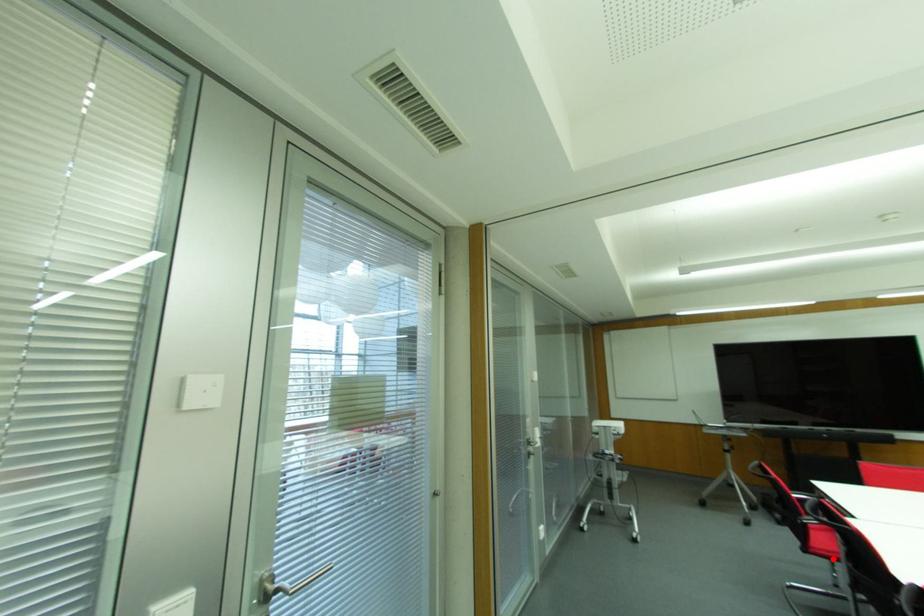
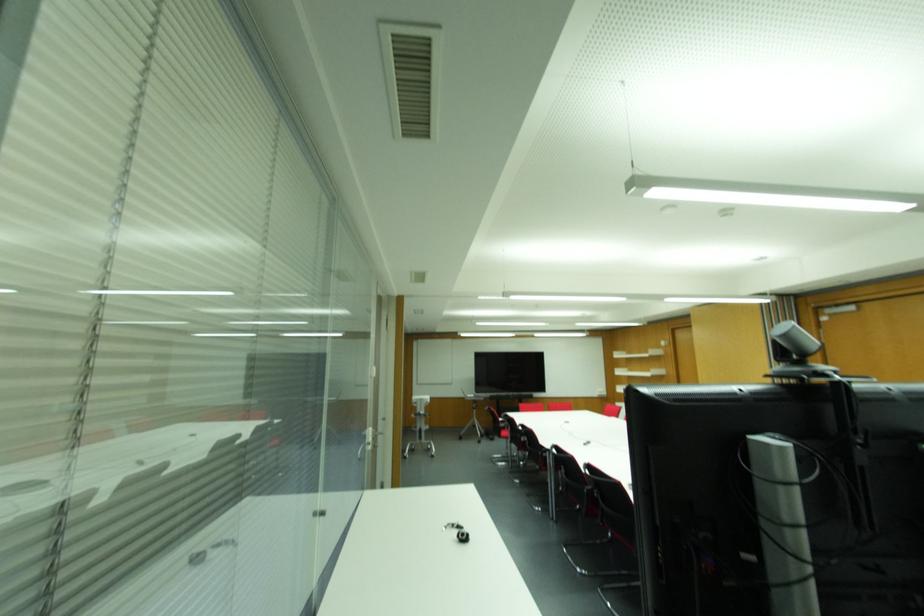
Question: I am providing you with two images of the same scene from different viewpoints. A red point is marked on the first image. Can you still see the location of the red point in image 2?

Choices:
 (A) Yes
 (B) No

Answer: (A)